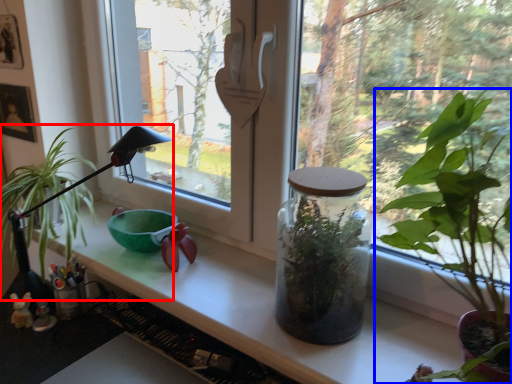
Question: Which of the following is the farthest to the observer, houseplant (highlighted by a red box) or houseplant (highlighted by a blue box)?

Choices:
 (A) houseplant
 (B) houseplant

Answer: (A)